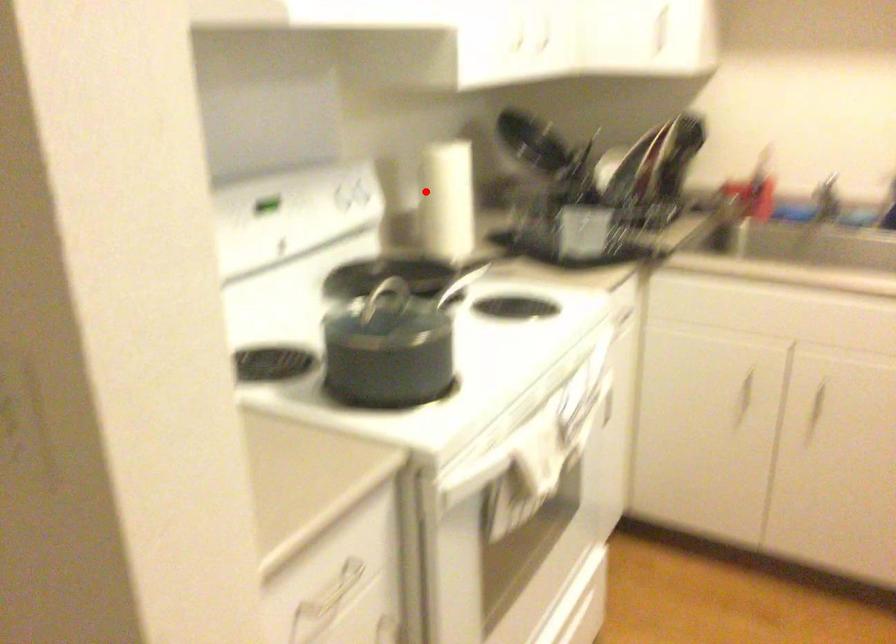
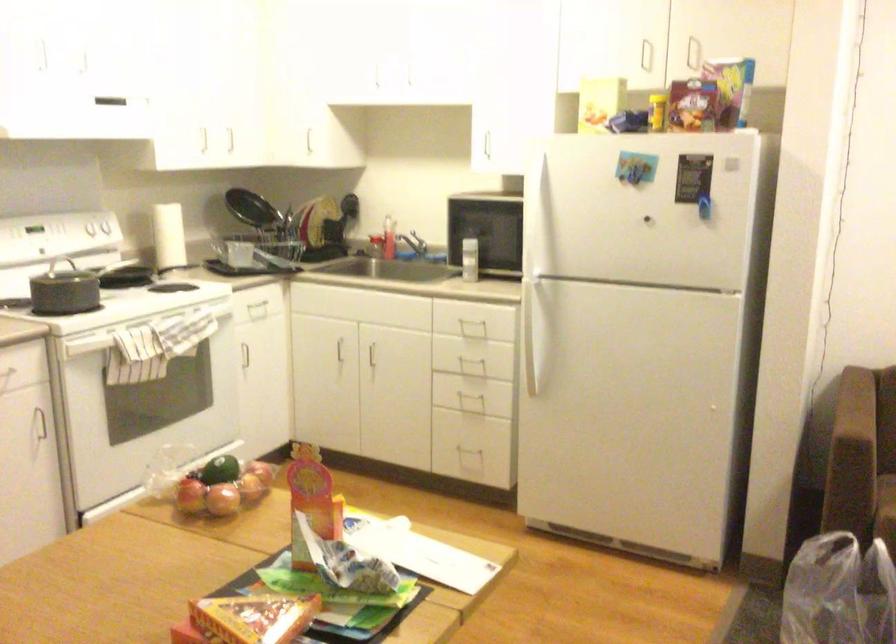
The point at the highlighted location is marked in the first image. Where is the corresponding point in the second image?

(168, 236)